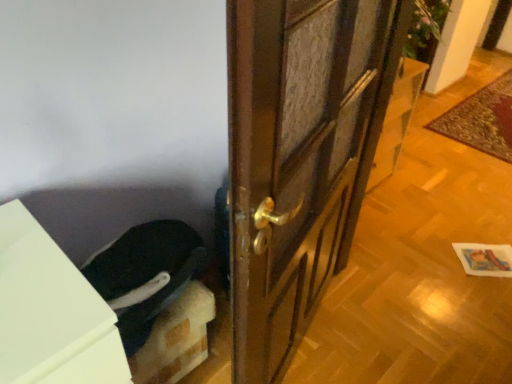
Question: From a real-world perspective, is white matte cabinet at lower left above or below dark blue fabric at lower left?

Choices:
 (A) above
 (B) below

Answer: (B)

Question: Considering the positions of white matte cabinet at lower left and dark blue fabric at lower left in the image, is white matte cabinet at lower left taller or shorter than dark blue fabric at lower left?

Choices:
 (A) tall
 (B) short

Answer: (A)

Question: Estimate the real-world distances between objects in this image. Which object is farther from the carpeted mat at right?

Choices:
 (A) white matte cabinet at lower left
 (B) dark blue fabric at lower left
 (C) brown wooden door at center

Answer: (A)

Question: Estimate the real-world distances between objects in this image. Which object is farther from the dark blue fabric at lower left?

Choices:
 (A) white matte cabinet at lower left
 (B) carpeted mat at right
 (C) brown wooden door at center

Answer: (B)